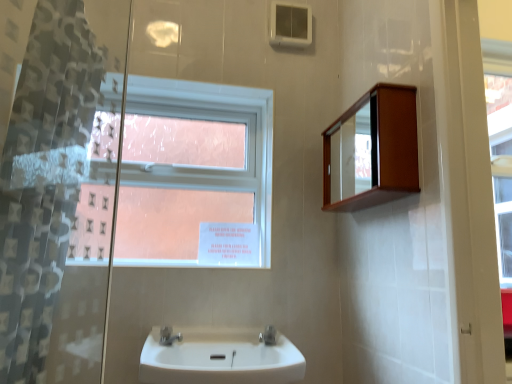
Locate an element on the screen. This screenshot has height=384, width=512. unoccupied space behind satin nickel faucet at lower center, arranged as the second tap when viewed from the right is located at coordinates (181, 338).